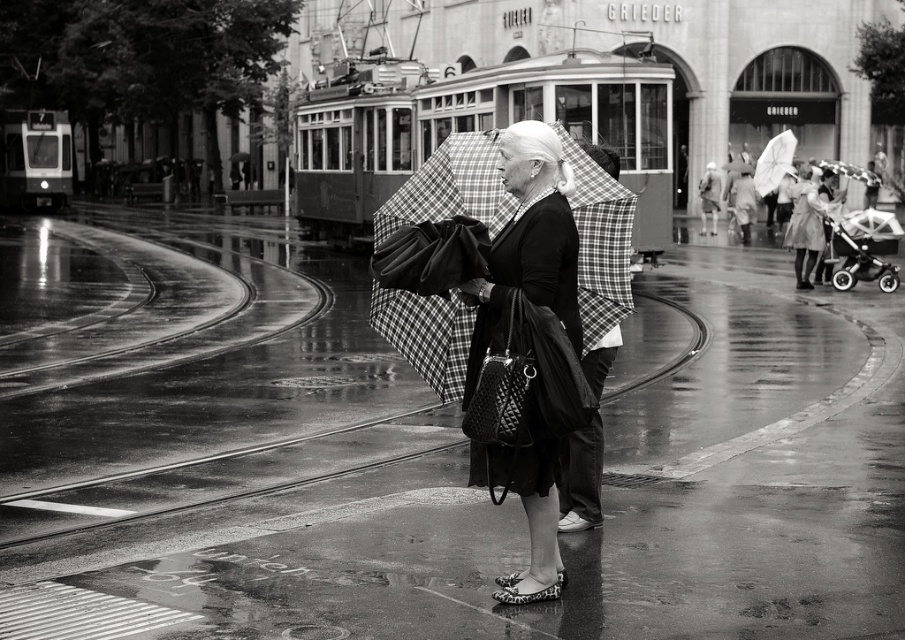
You are a pedestrian trying to cross the street while avoiding rain. You see a plaid fabric umbrella at center and a white matte umbrella at upper right. Which umbrella is shorter?

The plaid fabric umbrella at center is shorter than the white matte umbrella at upper right.